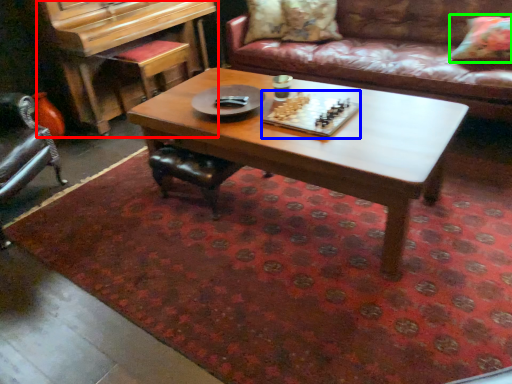
Question: Based on their relative distances, which object is farther from piano (highlighted by a red box)? Choose from board game (highlighted by a blue box) and pillow (highlighted by a green box).

Choices:
 (A) board game
 (B) pillow

Answer: (B)